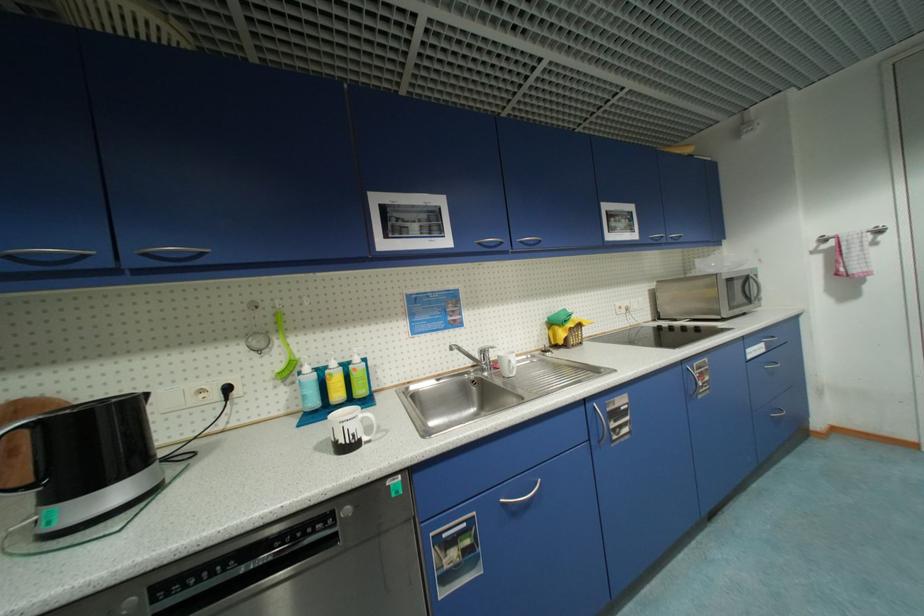
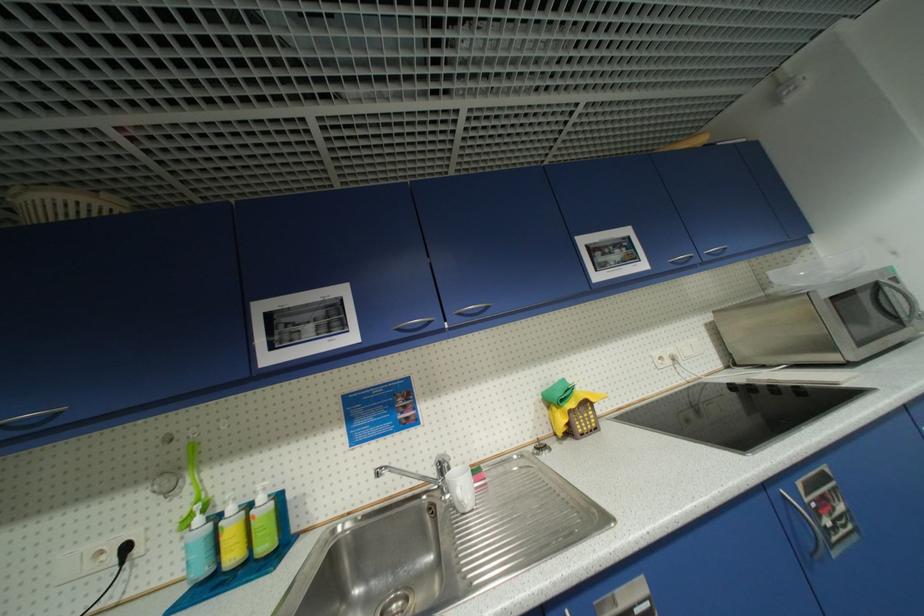
Where in the second image is the point corresponding to (710,257) from the first image?

(793, 265)